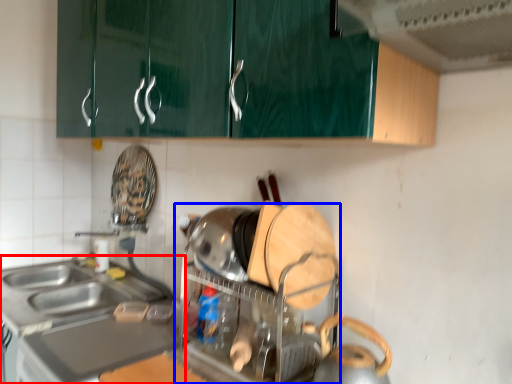
Question: Which object appears farthest to the camera in this image, countertop (highlighted by a red box) or appliance (highlighted by a blue box)?

Choices:
 (A) countertop
 (B) appliance

Answer: (A)